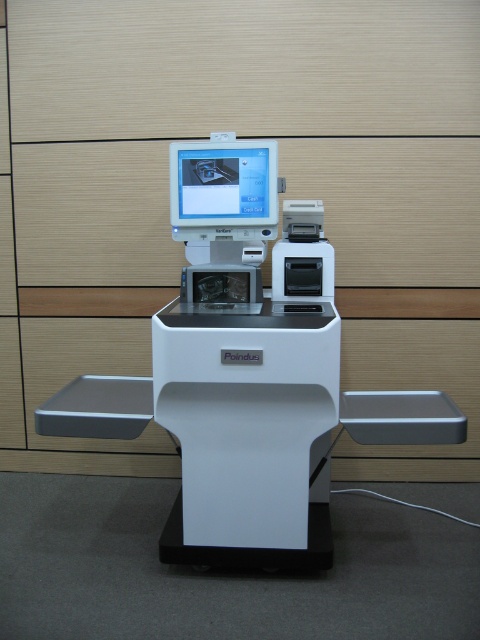
Looking at this image, you are standing in front of a modern kiosk. You need to locate the white plastic machine at center. According to the coordinates provided, where exactly is it positioned?

The white plastic machine at center is positioned at coordinates point (x=248, y=372).

You are a customer at the Poindus kiosk. You need to insert your credit card into the slot. Which object should you interact with first, the white plastic machine at center or the matte plastic monitor at center?

You should interact with the white plastic machine at center first because it is in front of the matte plastic monitor at center, making it more accessible to insert the credit card into the slot.

You need to place a small sticker on the smaller object between the white plastic machine at center and the matte plastic monitor at center. Which object should you choose?

The matte plastic monitor at center is smaller, so you should place the sticker on the matte plastic monitor at center.